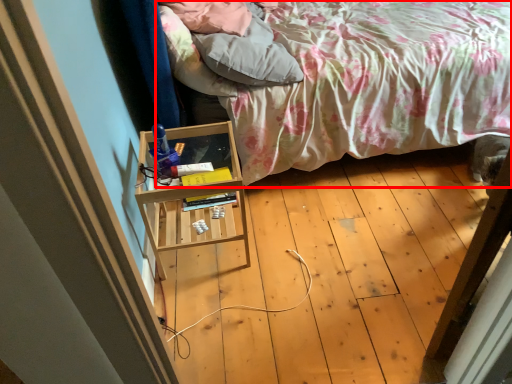
Question: From the image's perspective, what is the correct spatial relationship of bed (annotated by the red box) in relation to pillow?

Choices:
 (A) below
 (B) above

Answer: (B)